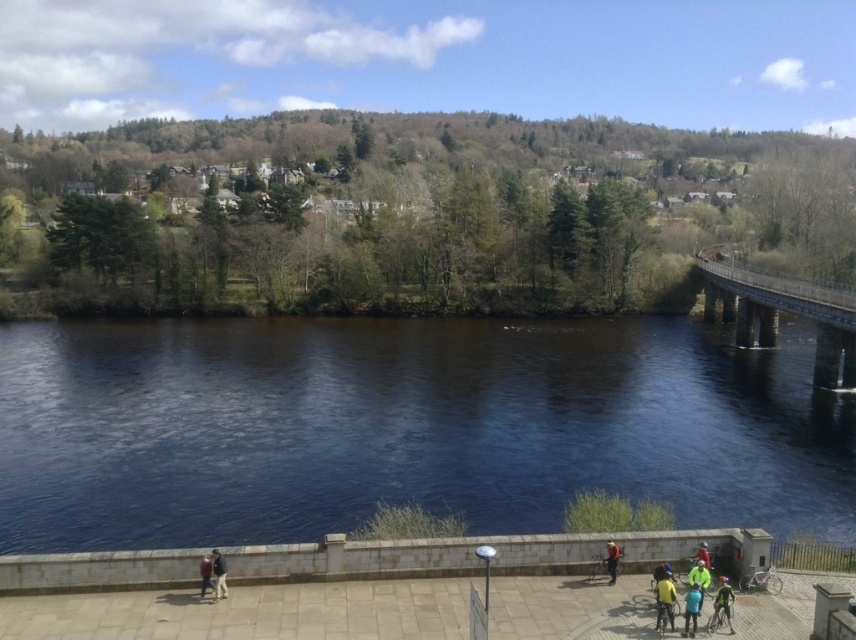
Which of these two, dark blue jeans at lower left or yellow helmeted cyclist at lower center, stands taller?

With more height is dark blue jeans at lower left.

Is dark blue jeans at lower left taller than yellow helmeted cyclist at lower center?

Yes, dark blue jeans at lower left is taller than yellow helmeted cyclist at lower center.

Which is in front, point (223, 561) or point (658, 570)?

Point (223, 561) is in front.

At what (x,y) coordinates should I click in order to perform the action: click on dark blue jeans at lower left. Please return your answer as a coordinate pair (x, y). Looking at the image, I should click on (218, 573).

Can you confirm if yellow helmeted cyclist at lower center is positioned below yellow jacket at lower right?

Correct, yellow helmeted cyclist at lower center is located below yellow jacket at lower right.

Does yellow helmeted cyclist at lower center have a smaller size compared to yellow jacket at lower right?

Yes.

Does point (657, 566) come behind point (703, 560)?

Yes, it is behind point (703, 560).

This screenshot has width=856, height=640. In order to click on yellow helmeted cyclist at lower center in this screenshot , I will do click(661, 573).

Is the position of green fabric jacket at lower right more distant than that of neon green jacket at lower right?

No, green fabric jacket at lower right is in front of neon green jacket at lower right.

Is green fabric jacket at lower right closer to camera compared to neon green jacket at lower right?

Yes, it is in front of neon green jacket at lower right.

Does point (720, 598) lie behind point (693, 568)?

No, it is in front of (693, 568).

Where is `green fabric jacket at lower right`? green fabric jacket at lower right is located at coordinates click(723, 604).